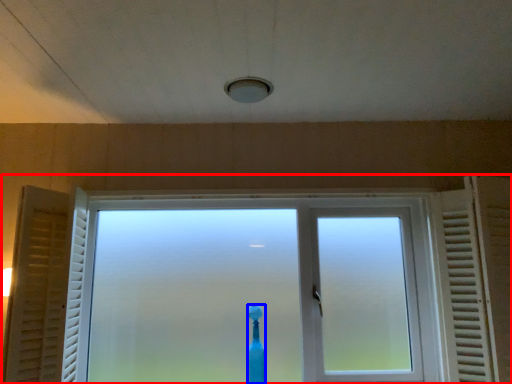
Question: Which of the following is the farthest to the observer, window (highlighted by a red box) or toothbrush (highlighted by a blue box)?

Choices:
 (A) window
 (B) toothbrush

Answer: (B)